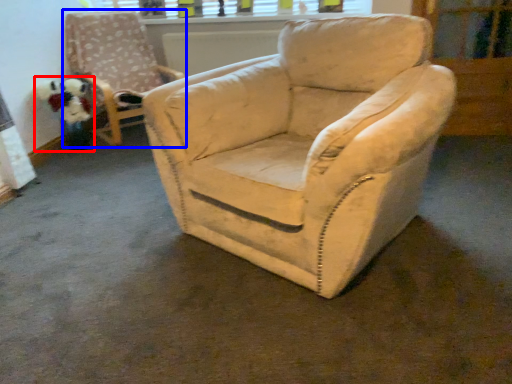
Question: Which object appears farthest to the camera in this image, toy (highlighted by a red box) or chair (highlighted by a blue box)?

Choices:
 (A) toy
 (B) chair

Answer: (A)